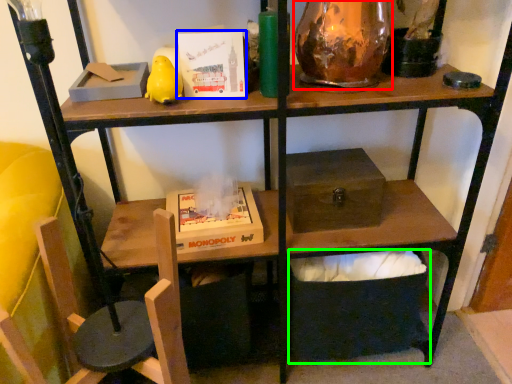
Question: Based on their relative distances, which object is nearer to glass vase (highlighted by a red box)? Choose from paperback book (highlighted by a blue box) and box (highlighted by a green box).

Choices:
 (A) paperback book
 (B) box

Answer: (A)